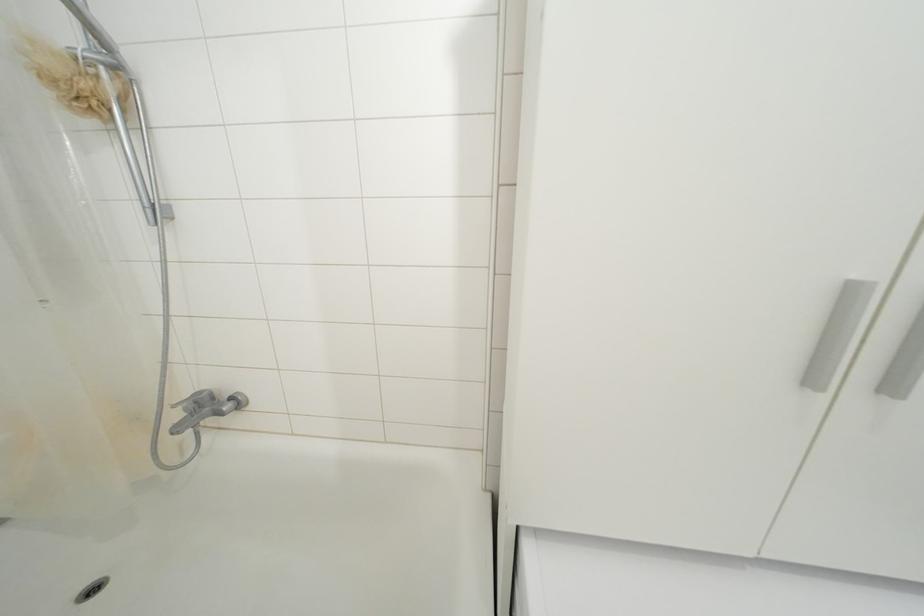
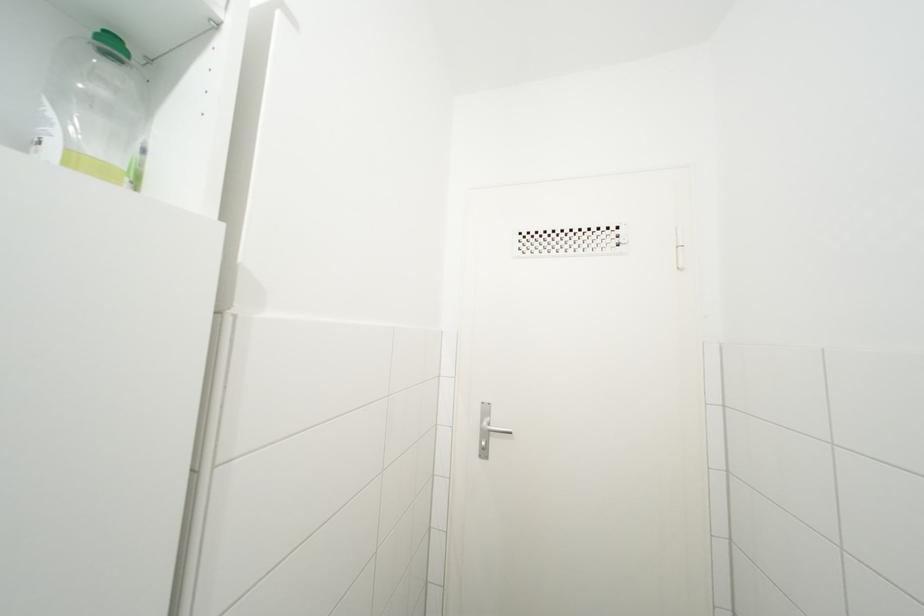
Question: The camera is either moving clockwise (left) or counter-clockwise (right) around the object. The first image is from the beginning of the video and the second image is from the end. Is the camera moving left or right when shooting the video?

Choices:
 (A) Left
 (B) Right

Answer: (A)